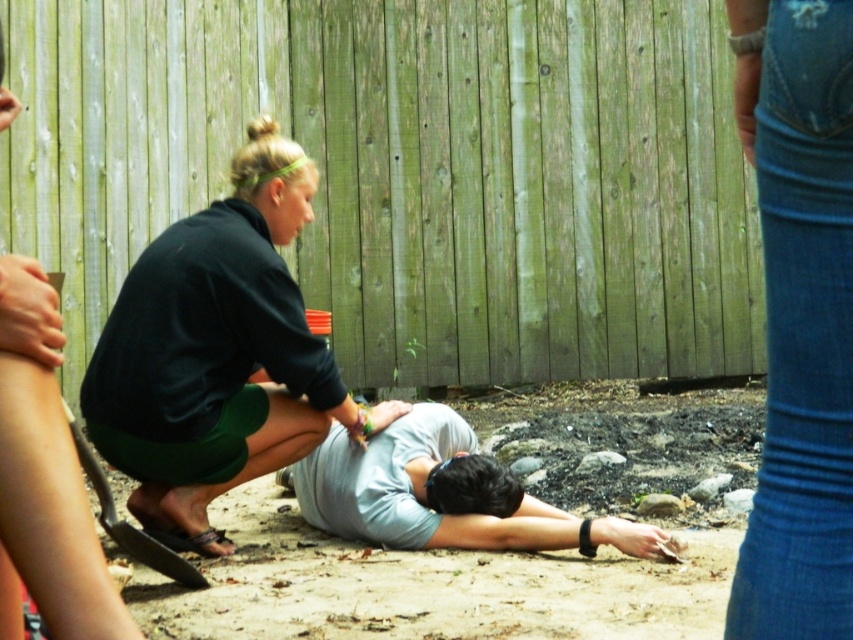
You are trying to determine if the green wood fence at upper center can be seen from the position of the gray matte shirt at center. Based on their widths, can you conclude this?

The green wood fence at upper center is wider than the gray matte shirt at center, so the fence would likely be visible from the shirt position.

You are a photographer trying to capture the denim jeans at lower right and the dark green fabric shorts at lower left in a single shot. Based on their positions, which one is covering part of the other?

The denim jeans at lower right is positioned over the dark green fabric shorts at lower left, so it is covering part of it.